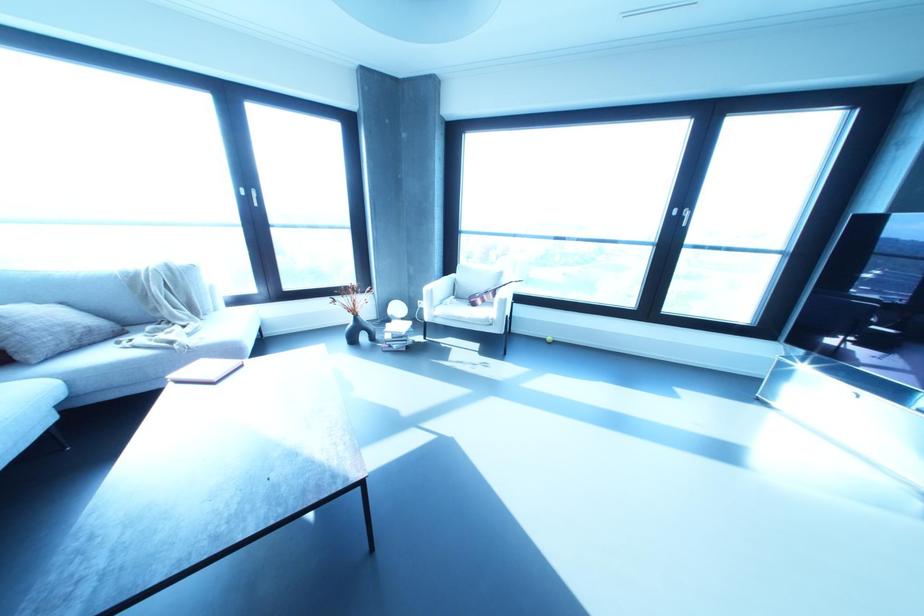
Where would you resting arm the white chair armrest? Please return your answer as a coordinate pair (x, y).

(440, 288)